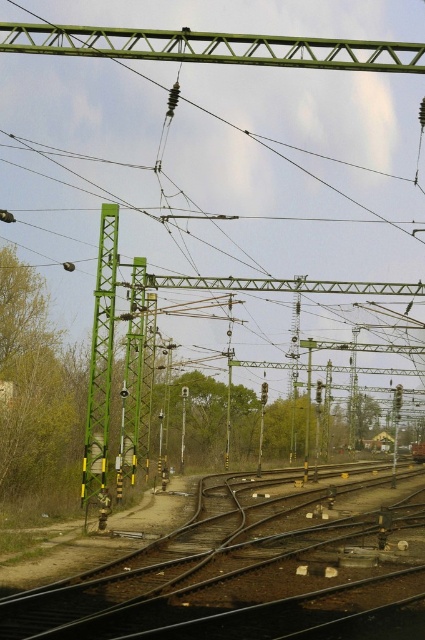
Question: Among these objects, which one is nearest to the camera?

Choices:
 (A) dark brown metal train track at center
 (B) green matte pole at center

Answer: (A)

Question: Can you confirm if dark brown metal train track at center is thinner than green matte pole at center?

Choices:
 (A) yes
 (B) no

Answer: (B)

Question: Can you confirm if dark brown metal train track at center is positioned below green matte pole at center?

Choices:
 (A) no
 (B) yes

Answer: (B)

Question: Does dark brown metal train track at center have a smaller size compared to green matte pole at center?

Choices:
 (A) yes
 (B) no

Answer: (B)

Question: Which point is closer to the camera?

Choices:
 (A) dark brown metal train track at center
 (B) green matte pole at center

Answer: (A)